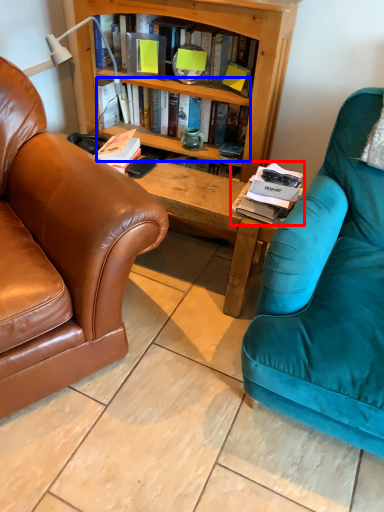
Question: Which point is closer to the camera, magazine (highlighted by a red box) or book (highlighted by a blue box)?

Choices:
 (A) magazine
 (B) book

Answer: (A)